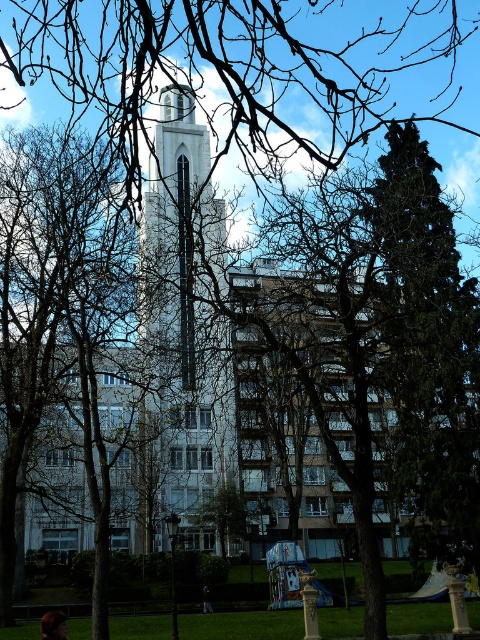
Is green leafy tree at right taller than white stone tower at center?

No.

Between point (451, 356) and point (199, 476), which one is positioned in front?

Point (451, 356) is more forward.

You are a GUI agent. You are given a task and a screenshot of the screen. Output one action in this format:
    pyautogui.click(x=<x>, y=<y>)
    Task: Click on the green leafy tree at right
    The image size is (480, 640).
    Given the screenshot: What is the action you would take?
    pyautogui.click(x=428, y=353)